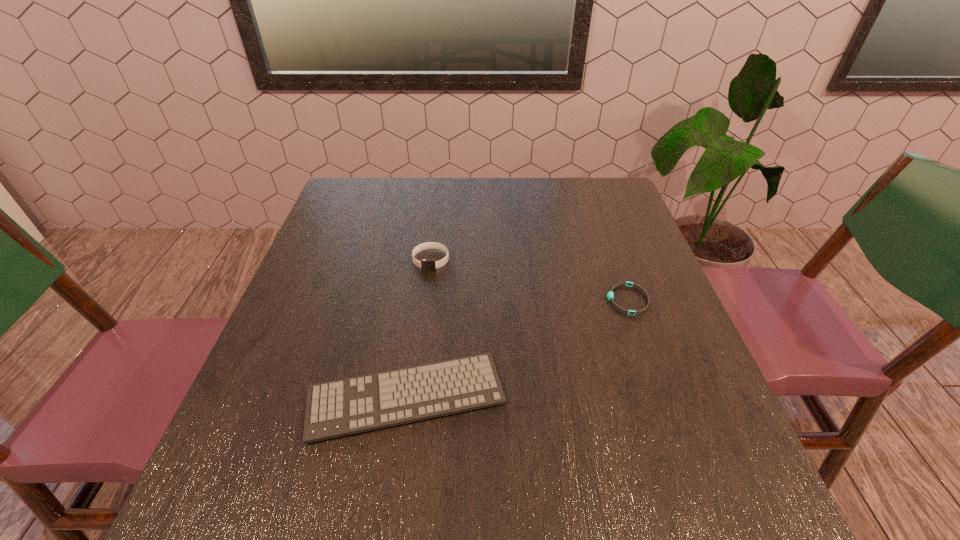
Identify which object is located as the second nearest to the second shortest object. Please provide its 2D coordinates. Your answer should be formatted as a tuple, i.e. [(x, y)], where the tuple contains the x and y coordinates of a point satisfying the conditions above.

[(610, 296)]

This screenshot has height=540, width=960. I want to click on vacant position in the image that satisfies the following two spatial constraints: 1. on the buckle of the right wristband; 2. on the front side of the second tallest object, so click(661, 396).